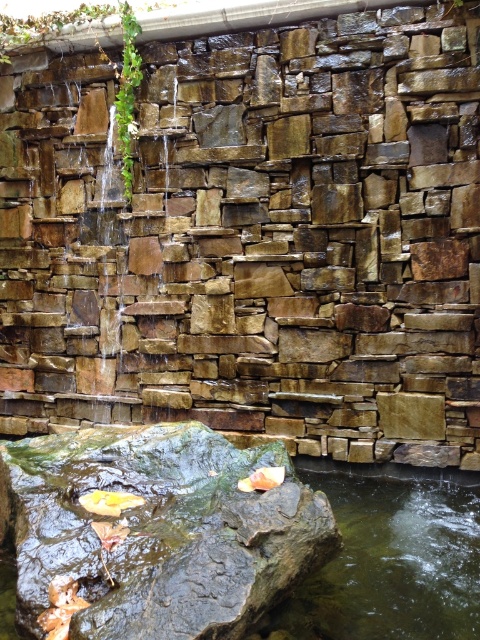
Who is more forward, (x=396, y=92) or (x=192, y=524)?

Point (x=192, y=524) is in front.

The image size is (480, 640). Describe the element at coordinates (253, 237) in the screenshot. I see `brown rough stone at center` at that location.

Does point (144, 378) come behind point (92, 452)?

Yes, point (144, 378) is behind point (92, 452).

You are a GUI agent. You are given a task and a screenshot of the screen. Output one action in this format:
    pyautogui.click(x=<x>, y=<y>)
    Task: Click on the brown rough stone at center
    The image size is (480, 640).
    Given the screenshot: What is the action you would take?
    pyautogui.click(x=253, y=237)